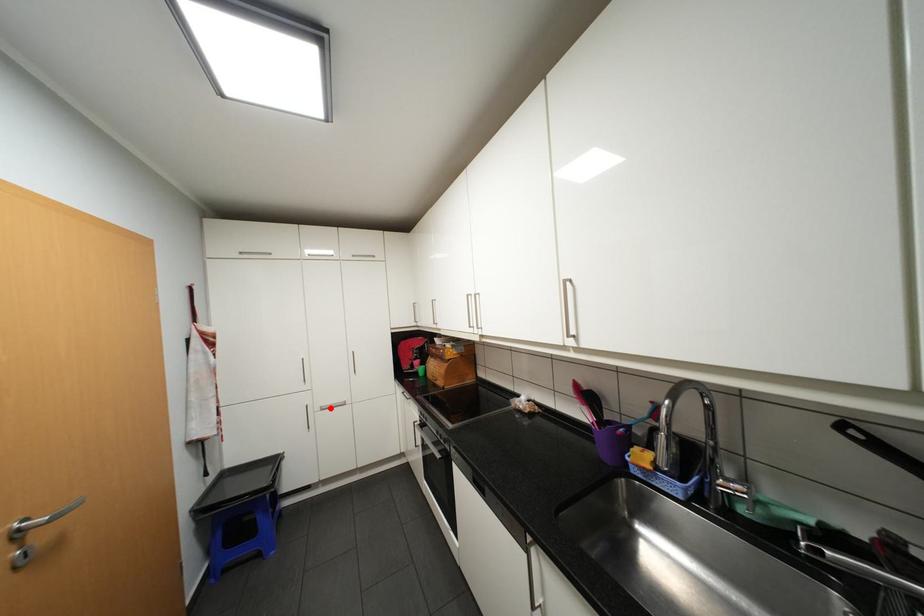
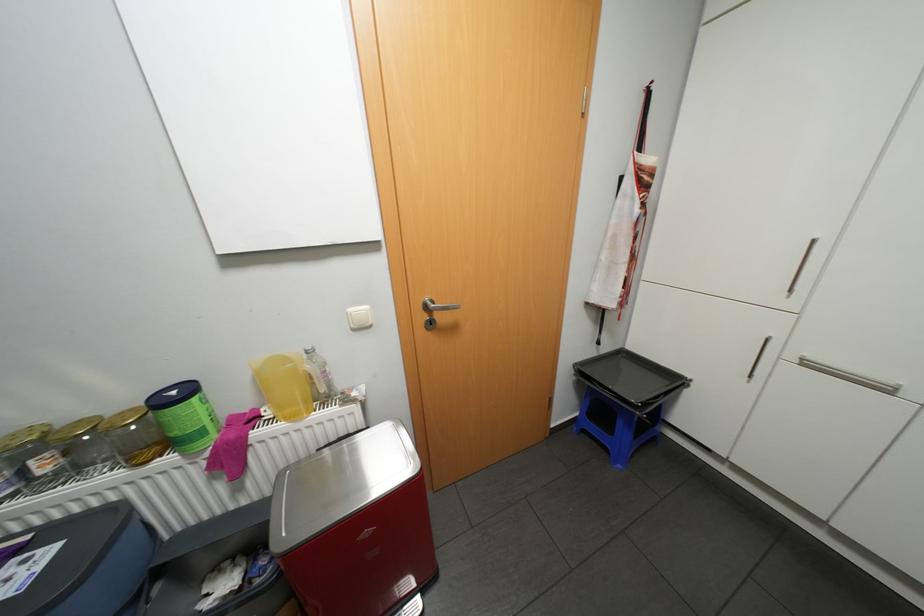
Question: I am providing you with two images of the same scene from different viewpoints. A red point is shown in image1. For the corresponding object point in image2, is it positioned nearer or farther from the camera?

Choices:
 (A) Nearer
 (B) Farther

Answer: (B)